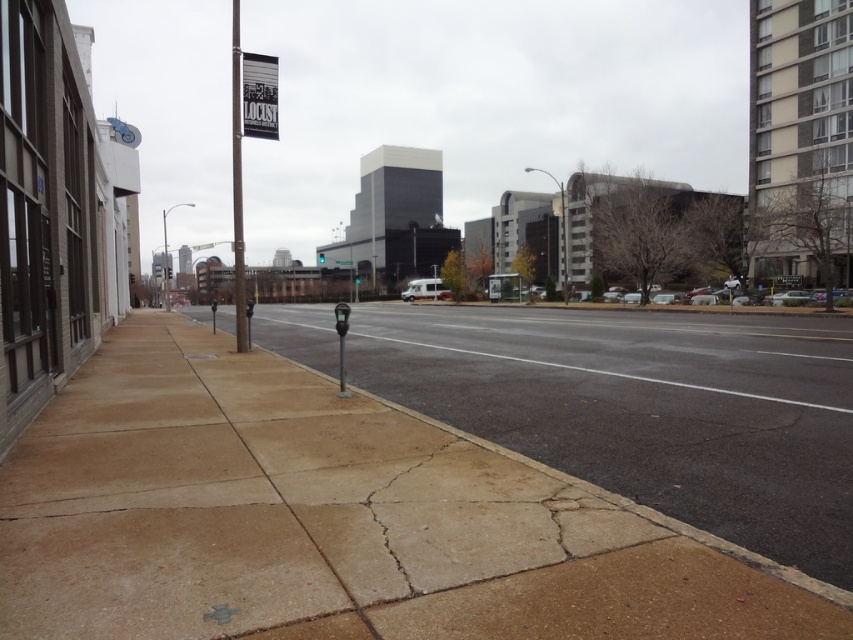
Which is behind, point (444, 289) or point (343, 262)?

Positioned behind is point (343, 262).

Between matte white van at center and green plastic street sign at center, which one appears on the left side from the viewer's perspective?

From the viewer's perspective, green plastic street sign at center appears more on the left side.

Locate an element on the screen. The height and width of the screenshot is (640, 853). matte white van at center is located at coordinates (425, 289).

Which is in front, point (276, 109) or point (335, 308)?

Point (335, 308) is more forward.

Between white plastic banner at upper center and metallic gray parking meter at center-left, which one is positioned lower?

metallic gray parking meter at center-left

Does point (248, 116) lie behind point (345, 307)?

Yes, it is behind point (345, 307).

I want to click on white plastic banner at upper center, so click(259, 96).

Is point (250, 298) positioned before point (338, 260)?

Yes, it is in front of point (338, 260).

Between point (251, 314) and point (344, 266), which one is positioned in front?

Point (251, 314)

Identify the location of metallic gray parking meter at lower left. (248, 320).